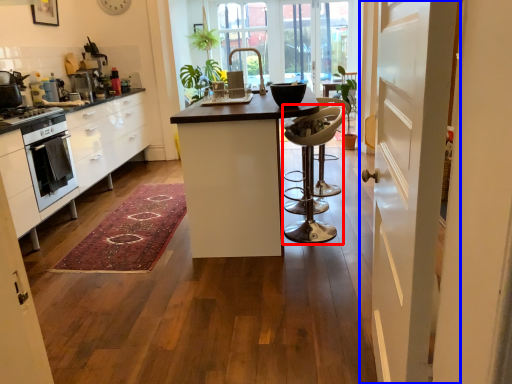
Question: Which object appears farthest to the camera in this image, bar stool (highlighted by a red box) or door (highlighted by a blue box)?

Choices:
 (A) bar stool
 (B) door

Answer: (A)